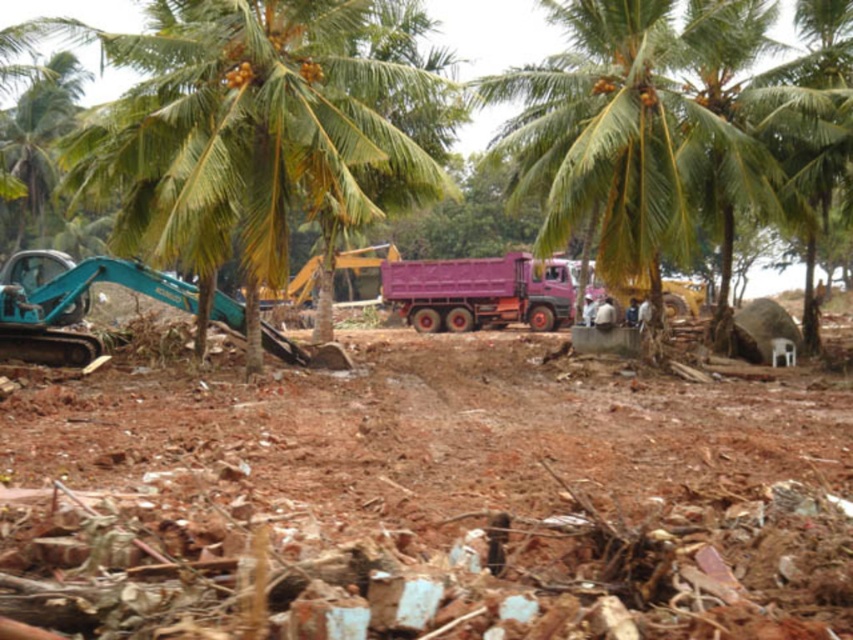
Question: Is brown earthy dirt field at center behind green leafy coconut tree at center?

Choices:
 (A) yes
 (B) no

Answer: (B)

Question: Is pink matte truck at center further to the viewer compared to teal metallic excavator at left?

Choices:
 (A) yes
 (B) no

Answer: (A)

Question: Which of the following is the farthest from the observer?

Choices:
 (A) teal metallic excavator at left
 (B) pink matte truck at center

Answer: (B)

Question: From the image, what is the correct spatial relationship of brown earthy dirt field at center in relation to green leafy coconut tree at center?

Choices:
 (A) above
 (B) below

Answer: (B)

Question: Estimate the real-world distances between objects in this image. Which object is farther from the pink matte truck at center?

Choices:
 (A) green leafy coconut tree at center
 (B) teal metallic excavator at left

Answer: (B)

Question: Which point is closer to the camera taking this photo?

Choices:
 (A) (22, 320)
 (B) (334, 115)

Answer: (B)